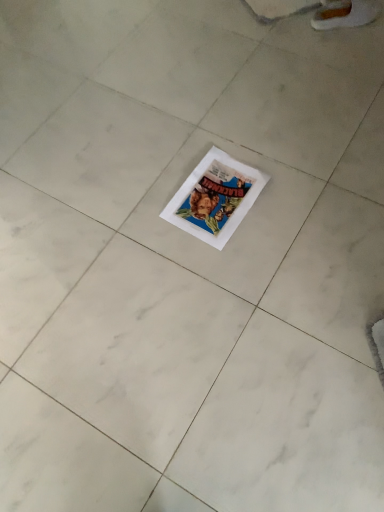
You are a GUI agent. You are given a task and a screenshot of the screen. Output one action in this format:
    pyautogui.click(x=<x>, y=<y>)
    Task: Click on the free space in front of white rubber shoe at upper right
    This screenshot has height=512, width=384.
    Given the screenshot: What is the action you would take?
    pyautogui.click(x=350, y=46)